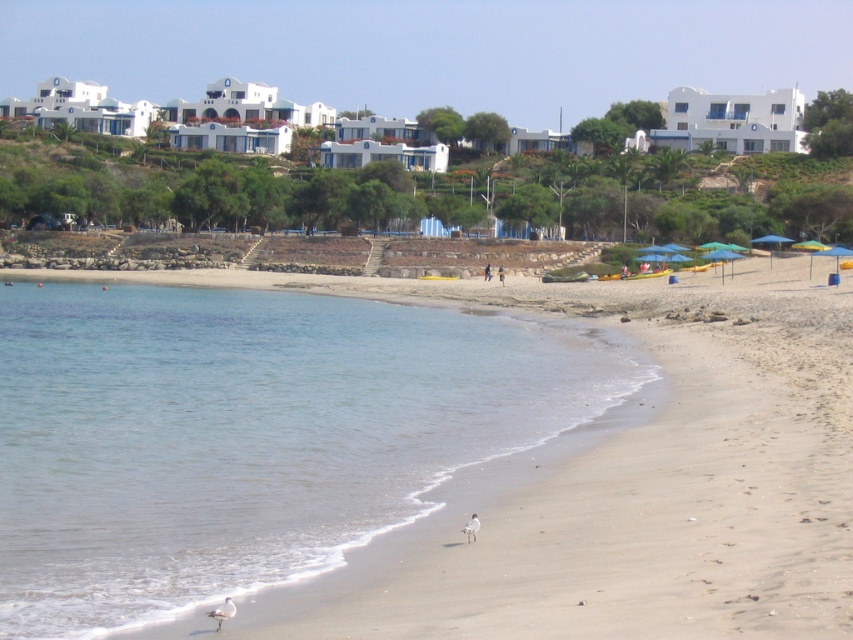
You are standing on the beach and see a white feathered bird at lower left. There is a point marked at coordinates [222,611]. Where exactly is this point located?

The point at [222,611] is located on the white feathered bird at lower left.

You are standing on the beach and see two points marked in the scene. Which point, point (556, 352) or point (488, 278), is closer to you?

Point (556, 352) is closer to the viewer than point (488, 278).

You are standing at the point marked as point (x=247, y=435) and want to find the clear blue water at lower left. Which direction should you face to see it?

The clear blue water at lower left is located at point (x=247, y=435), so you should face towards the lower left direction to see it.